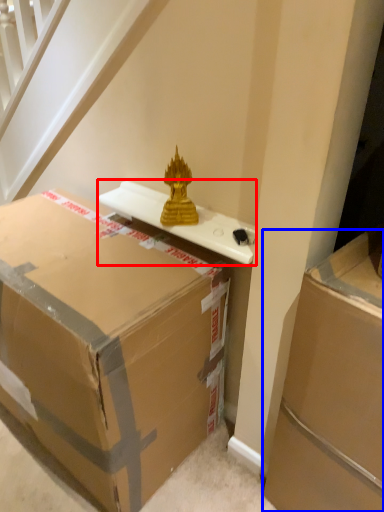
Question: Which object appears closest to the camera in this image, table (highlighted by a red box) or box (highlighted by a blue box)?

Choices:
 (A) table
 (B) box

Answer: (B)